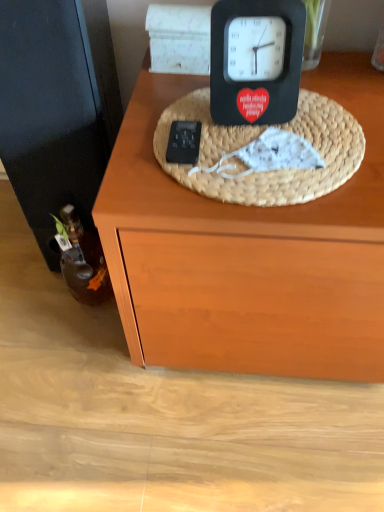
Question: Can you confirm if black matte clock at upper center is positioned to the right of woven straw basket at center?

Choices:
 (A) no
 (B) yes

Answer: (A)

Question: From a real-world perspective, is black matte clock at upper center physically below woven straw basket at center?

Choices:
 (A) no
 (B) yes

Answer: (A)

Question: Is black matte clock at upper center taller than woven straw basket at center?

Choices:
 (A) yes
 (B) no

Answer: (A)

Question: Can you confirm if black matte clock at upper center is thinner than woven straw basket at center?

Choices:
 (A) yes
 (B) no

Answer: (A)

Question: Is black matte clock at upper center positioned with its back to woven straw basket at center?

Choices:
 (A) yes
 (B) no

Answer: (B)

Question: Can you confirm if black matte clock at upper center is bigger than woven straw basket at center?

Choices:
 (A) no
 (B) yes

Answer: (B)

Question: Can you confirm if black matte clock at upper center is wider than brown glass bottle at left?

Choices:
 (A) no
 (B) yes

Answer: (B)

Question: Is black matte clock at upper center completely or partially outside of brown glass bottle at left?

Choices:
 (A) yes
 (B) no

Answer: (A)

Question: Can you confirm if black matte clock at upper center is bigger than brown glass bottle at left?

Choices:
 (A) yes
 (B) no

Answer: (A)

Question: From the image's perspective, is black matte clock at upper center on brown glass bottle at left?

Choices:
 (A) yes
 (B) no

Answer: (A)

Question: Considering the relative positions of black matte clock at upper center and brown glass bottle at left in the image provided, is black matte clock at upper center behind brown glass bottle at left?

Choices:
 (A) yes
 (B) no

Answer: (B)

Question: Is black matte clock at upper center far from brown glass bottle at left?

Choices:
 (A) no
 (B) yes

Answer: (A)

Question: Is woven straw basket at center smaller than brown glass bottle at left?

Choices:
 (A) no
 (B) yes

Answer: (B)